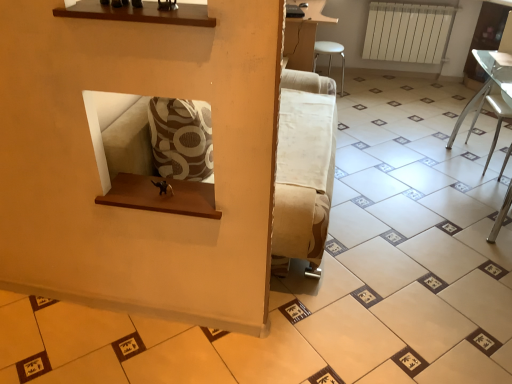
Where is `vacant space in between white plastic stool at upper right, positioned as the 2th furniture in front-to-back order, and clear glass table at right, which appears as the 1th furniture when ordered from the bottom`? This screenshot has height=384, width=512. vacant space in between white plastic stool at upper right, positioned as the 2th furniture in front-to-back order, and clear glass table at right, which appears as the 1th furniture when ordered from the bottom is located at coordinates (398, 142).